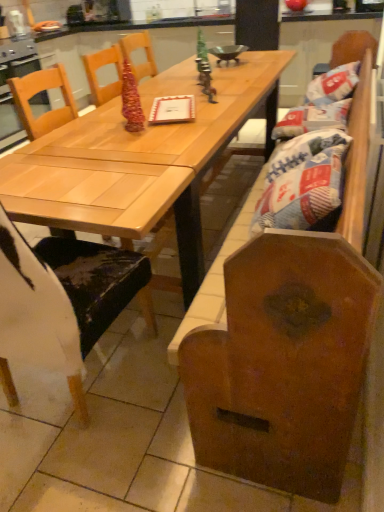
Question: Considering the relative positions of white paper bag at right and light wood table at center in the image provided, is white paper bag at right to the left of light wood table at center from the viewer's perspective?

Choices:
 (A) yes
 (B) no

Answer: (B)

Question: Is light wood table at center completely or partially inside white paper bag at right?

Choices:
 (A) yes
 (B) no

Answer: (B)

Question: Is white paper bag at right turned away from light wood table at center?

Choices:
 (A) yes
 (B) no

Answer: (B)

Question: Is white paper bag at right smaller than light wood table at center?

Choices:
 (A) yes
 (B) no

Answer: (A)

Question: Is the depth of white paper bag at right less than that of light wood table at center?

Choices:
 (A) yes
 (B) no

Answer: (B)

Question: Considering the positions of white paper bag at right and light wood table at center in the image, is white paper bag at right taller or shorter than light wood table at center?

Choices:
 (A) short
 (B) tall

Answer: (A)

Question: Based on their positions, is white paper bag at right located to the left or right of light wood table at center?

Choices:
 (A) left
 (B) right

Answer: (B)

Question: In terms of size, does white paper bag at right appear bigger or smaller than light wood table at center?

Choices:
 (A) small
 (B) big

Answer: (A)

Question: From the image's perspective, relative to light wood table at center, is white paper bag at right above or below?

Choices:
 (A) above
 (B) below

Answer: (B)

Question: Considering the relative positions of white paper bag at right and wooden chair at left in the image provided, is white paper bag at right to the left or to the right of wooden chair at left?

Choices:
 (A) right
 (B) left

Answer: (A)

Question: Is white paper bag at right taller or shorter than wooden chair at left?

Choices:
 (A) tall
 (B) short

Answer: (B)

Question: Based on their sizes in the image, would you say white paper bag at right is bigger or smaller than wooden chair at left?

Choices:
 (A) small
 (B) big

Answer: (A)

Question: Is point (274, 156) positioned closer to the camera than point (14, 301)?

Choices:
 (A) farther
 (B) closer

Answer: (A)

Question: Visually, is light wood table at center positioned to the left or to the right of white paper bag at right?

Choices:
 (A) right
 (B) left

Answer: (B)

Question: Is light wood table at center taller or shorter than white paper bag at right?

Choices:
 (A) tall
 (B) short

Answer: (A)